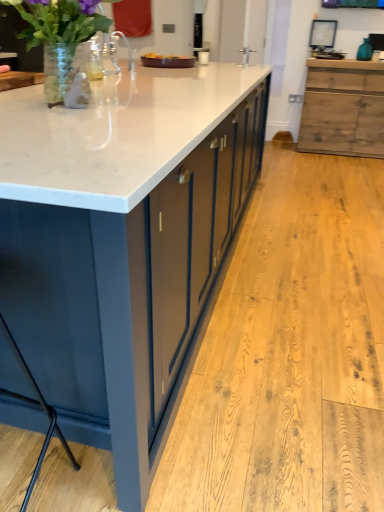
Identify the location of vacant space to the right of clear glass vase at upper left. The height and width of the screenshot is (512, 384). (168, 105).